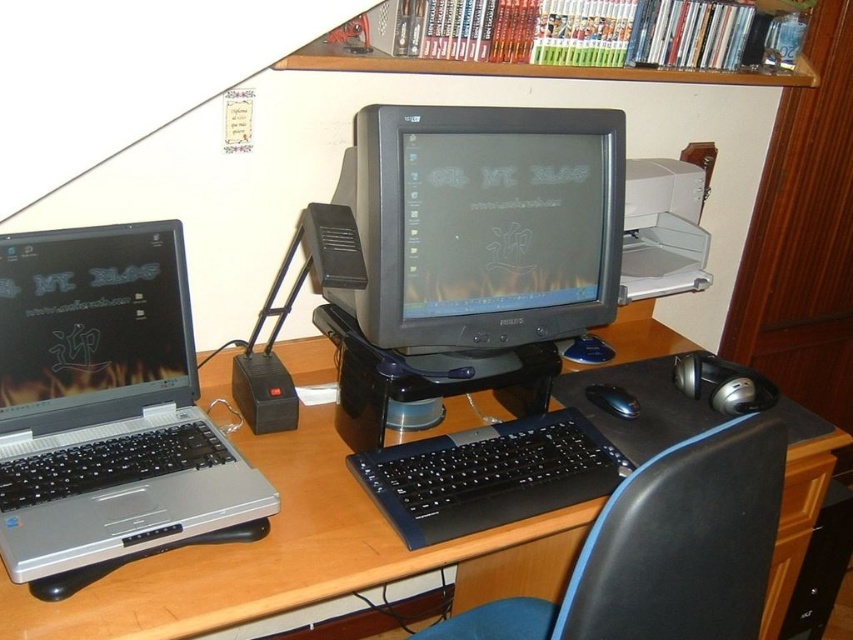
Question: Can you confirm if matte black monitor at center is positioned below wooden drawer at lower right?

Choices:
 (A) no
 (B) yes

Answer: (A)

Question: Which point appears closest to the camera in this image?

Choices:
 (A) [610, 385]
 (B) [782, 497]
 (C) [105, 253]

Answer: (C)

Question: Observing the image, what is the correct spatial positioning of matte black monitor at center in reference to wooden drawer at lower right?

Choices:
 (A) above
 (B) below

Answer: (A)

Question: Which object appears closest to the camera in this image?

Choices:
 (A) black plastic keyboard at center
 (B) shiny black laptop at left
 (C) wooden desk at center
 (D) black plastic chair at lower right

Answer: (D)

Question: Which point appears closest to the camera in this image?

Choices:
 (A) (375, 563)
 (B) (376, 129)

Answer: (A)

Question: Does matte black monitor at center have a larger size compared to black matte mouse at center?

Choices:
 (A) yes
 (B) no

Answer: (A)